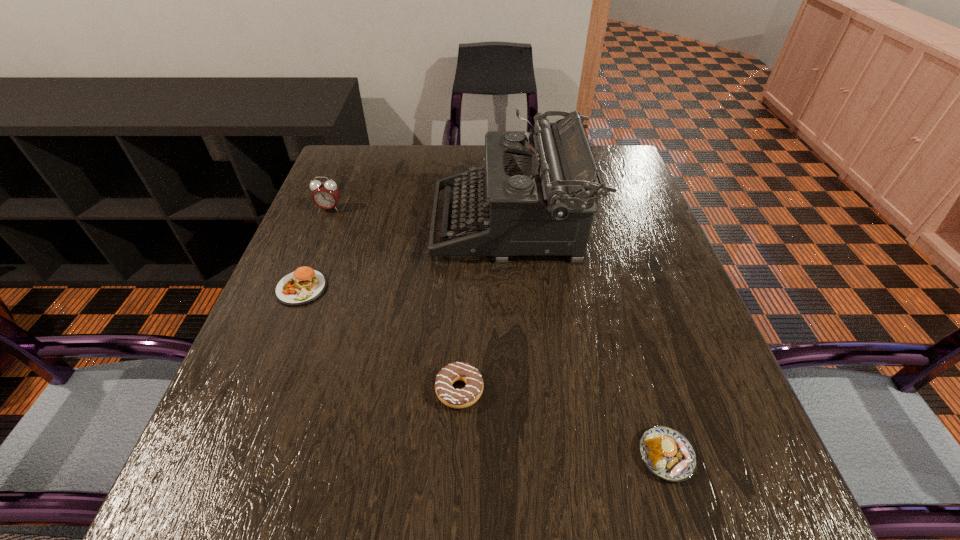
Identify the location of free space at the right edge of the desktop. The height and width of the screenshot is (540, 960). (666, 338).

Locate an element on the screen. This screenshot has height=540, width=960. free spot at the far left corner of the desktop is located at coordinates (378, 182).

Locate an element on the screen. The height and width of the screenshot is (540, 960). free spot between the second nearest object and the nearest object is located at coordinates (563, 423).

This screenshot has width=960, height=540. What are the coordinates of `vacant area between the second nearest object and the tallest object` in the screenshot? It's located at (485, 307).

Find the location of `vacant point located between the alarm clock and the nearest object`. vacant point located between the alarm clock and the nearest object is located at coordinates (497, 332).

Image resolution: width=960 pixels, height=540 pixels. Identify the location of empty space between the second nearest object and the tallest object. (485, 307).

You are a GUI agent. You are given a task and a screenshot of the screen. Output one action in this format:
    pyautogui.click(x=<x>, y=<y>)
    Task: Click on the vacant area that lies between the pastry and the patty
    
    Given the screenshot: What is the action you would take?
    pyautogui.click(x=484, y=372)

I want to click on free space between the nearest object and the fourth shortest object, so click(x=497, y=332).

This screenshot has width=960, height=540. I want to click on free spot between the typewriter and the doughnut, so click(485, 307).

Identify the location of free spot between the doughnut and the third tallest object. The image size is (960, 540). (380, 339).